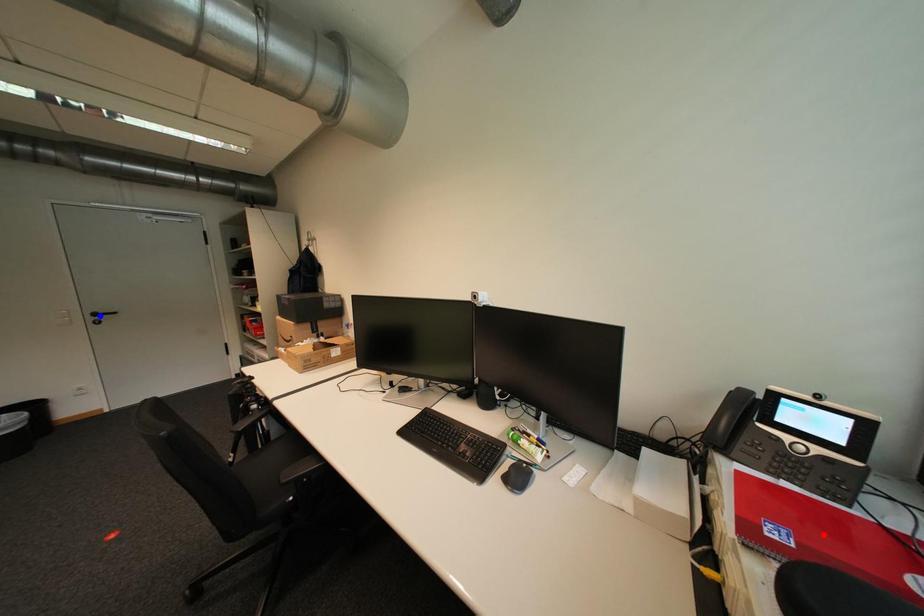
Question: Two points are marked on the image. Which point is closer to the camera?

Choices:
 (A) Blue point is closer.
 (B) Red point is closer.

Answer: (B)